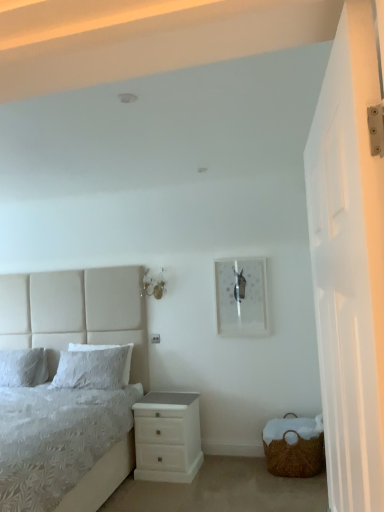
Question: From a real-world perspective, is white soft pillow at left, which ranks as the 1th pillow in right-to-left order, on top of white soft pillow at left, the 2th pillow in the right-to-left sequence?

Choices:
 (A) no
 (B) yes

Answer: (A)

Question: Is white soft pillow at left, which is the second pillow in left-to-right order, shorter than white soft pillow at left, the 2th pillow in the right-to-left sequence?

Choices:
 (A) yes
 (B) no

Answer: (B)

Question: Considering the relative positions of white soft pillow at left, which ranks as the 1th pillow in right-to-left order, and white soft pillow at left, marked as the 1th pillow in a left-to-right arrangement, in the image provided, is white soft pillow at left, which ranks as the 1th pillow in right-to-left order, to the left of white soft pillow at left, marked as the 1th pillow in a left-to-right arrangement, from the viewer's perspective?

Choices:
 (A) yes
 (B) no

Answer: (B)

Question: From a real-world perspective, is white soft pillow at left, which ranks as the 1th pillow in right-to-left order, located beneath white soft pillow at left, the 2th pillow in the right-to-left sequence?

Choices:
 (A) no
 (B) yes

Answer: (B)

Question: Does white soft pillow at left, which is the second pillow in left-to-right order, have a larger size compared to white soft pillow at left, marked as the 1th pillow in a left-to-right arrangement?

Choices:
 (A) no
 (B) yes

Answer: (A)

Question: Considering the relative sizes of white soft pillow at left, which is the second pillow in left-to-right order, and white soft pillow at left, marked as the 1th pillow in a left-to-right arrangement, in the image provided, is white soft pillow at left, which is the second pillow in left-to-right order, thinner than white soft pillow at left, marked as the 1th pillow in a left-to-right arrangement,?

Choices:
 (A) no
 (B) yes

Answer: (B)

Question: Can you confirm if white glossy door at right is smaller than white fabric bed at left?

Choices:
 (A) yes
 (B) no

Answer: (A)

Question: From a real-world perspective, is white glossy door at right located higher than white fabric bed at left?

Choices:
 (A) no
 (B) yes

Answer: (B)

Question: Is the depth of white glossy door at right greater than that of white fabric bed at left?

Choices:
 (A) yes
 (B) no

Answer: (B)

Question: Considering the relative positions of white glossy door at right and white fabric bed at left in the image provided, is white glossy door at right to the left of white fabric bed at left from the viewer's perspective?

Choices:
 (A) yes
 (B) no

Answer: (B)

Question: Is white glossy door at right positioned before white fabric bed at left?

Choices:
 (A) yes
 (B) no

Answer: (A)

Question: Is white glossy door at right bigger than white fabric bed at left?

Choices:
 (A) yes
 (B) no

Answer: (B)

Question: From a real-world perspective, is white glossy door at right under white soft pillow at left, marked as the 1th pillow in a left-to-right arrangement?

Choices:
 (A) yes
 (B) no

Answer: (B)